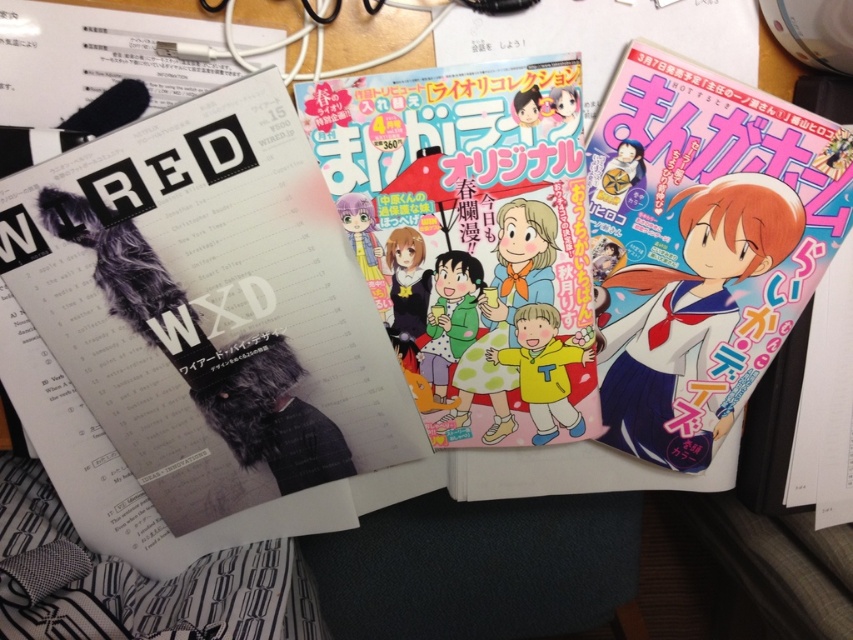
Question: Does matte black magazine at left appear under matte white manga at right?

Choices:
 (A) no
 (B) yes

Answer: (B)

Question: Considering the real-world distances, which object is farthest from the matte white manga at right?

Choices:
 (A) pastel matte manga at center
 (B) matte black magazine at left

Answer: (B)

Question: Is pastel matte manga at center bigger than matte white manga at right?

Choices:
 (A) yes
 (B) no

Answer: (B)

Question: Among these points, which one is nearest to the camera?

Choices:
 (A) (451, 340)
 (B) (231, 112)
 (C) (663, 396)

Answer: (B)

Question: Does matte black magazine at left have a lesser width compared to pastel matte manga at center?

Choices:
 (A) yes
 (B) no

Answer: (B)

Question: Estimate the real-world distances between objects in this image. Which object is closer to the matte white manga at right?

Choices:
 (A) matte black magazine at left
 (B) pastel matte manga at center

Answer: (B)